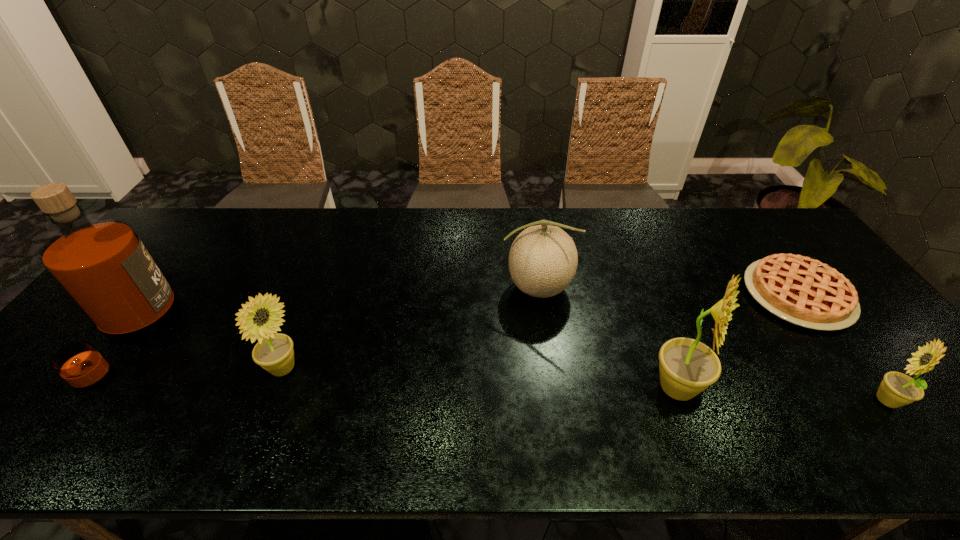
Where is `pie present at the right edge`? The height and width of the screenshot is (540, 960). pie present at the right edge is located at coordinates (803, 291).

Find the location of a particular element. Image resolution: width=960 pixels, height=540 pixels. object present at the near left corner is located at coordinates (103, 266).

Image resolution: width=960 pixels, height=540 pixels. Find the location of `object at the near right corner`. object at the near right corner is located at coordinates (897, 389).

The height and width of the screenshot is (540, 960). What are the coordinates of `free spot at the far edge of the desktop` in the screenshot? It's located at (376, 236).

The width and height of the screenshot is (960, 540). In the image, there is a desktop. Find the location of `free space at the near edge`. free space at the near edge is located at coordinates (116, 410).

Where is `free region at the right edge of the desktop`? This screenshot has height=540, width=960. free region at the right edge of the desktop is located at coordinates (838, 338).

Where is `vacant space at the far right corner of the desktop`? The height and width of the screenshot is (540, 960). vacant space at the far right corner of the desktop is located at coordinates (752, 212).

This screenshot has width=960, height=540. What are the coordinates of `blank region between the shortest sunflower and the fourth object from right to left` in the screenshot? It's located at (711, 344).

This screenshot has width=960, height=540. Find the location of `free spot between the second tallest object and the leftmost sunflower`. free spot between the second tallest object and the leftmost sunflower is located at coordinates (480, 380).

The height and width of the screenshot is (540, 960). I want to click on free space that is in between the leftmost object and the second shortest sunflower, so click(x=206, y=354).